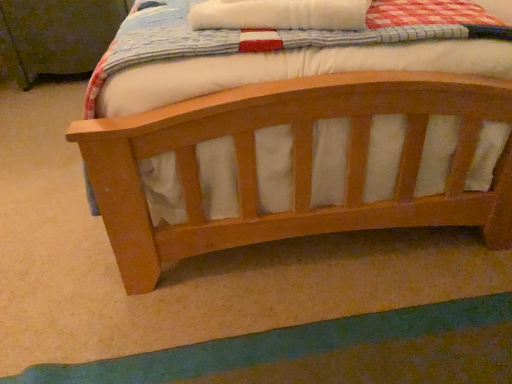
Question: Is green fabric at lower center looking in the opposite direction of light brown wood bed at center?

Choices:
 (A) yes
 (B) no

Answer: (A)

Question: From a real-world perspective, is green fabric at lower center physically above light brown wood bed at center?

Choices:
 (A) yes
 (B) no

Answer: (A)

Question: Could you tell me if green fabric at lower center is turned towards light brown wood bed at center?

Choices:
 (A) yes
 (B) no

Answer: (A)

Question: From the image's perspective, is green fabric at lower center below light brown wood bed at center?

Choices:
 (A) no
 (B) yes

Answer: (B)

Question: Is green fabric at lower center next to light brown wood bed at center?

Choices:
 (A) yes
 (B) no

Answer: (B)

Question: Considering the positions of point (282, 205) and point (62, 24), is point (282, 205) closer or farther from the camera than point (62, 24)?

Choices:
 (A) closer
 (B) farther

Answer: (A)

Question: Do you think light brown wood bed at center is within wooden changing table at upper left, or outside of it?

Choices:
 (A) inside
 (B) outside

Answer: (B)

Question: Visually, is light brown wood bed at center positioned to the left or to the right of wooden changing table at upper left?

Choices:
 (A) right
 (B) left

Answer: (A)

Question: From a real-world perspective, is light brown wood bed at center above or below wooden changing table at upper left?

Choices:
 (A) above
 (B) below

Answer: (B)

Question: From a real-world perspective, relative to light brown wood bed at center, is wooden changing table at upper left vertically above or below?

Choices:
 (A) above
 (B) below

Answer: (A)

Question: Is wooden changing table at upper left in front of or behind light brown wood bed at center in the image?

Choices:
 (A) behind
 (B) front

Answer: (A)

Question: Is point (87, 38) positioned closer to the camera than point (455, 218)?

Choices:
 (A) farther
 (B) closer

Answer: (A)

Question: In terms of height, does wooden changing table at upper left look taller or shorter compared to light brown wood bed at center?

Choices:
 (A) tall
 (B) short

Answer: (A)

Question: In the image, is light brown wood bed at center positioned in front of or behind green fabric at lower center?

Choices:
 (A) behind
 (B) front

Answer: (B)

Question: Do you think light brown wood bed at center is within green fabric at lower center, or outside of it?

Choices:
 (A) outside
 (B) inside

Answer: (A)